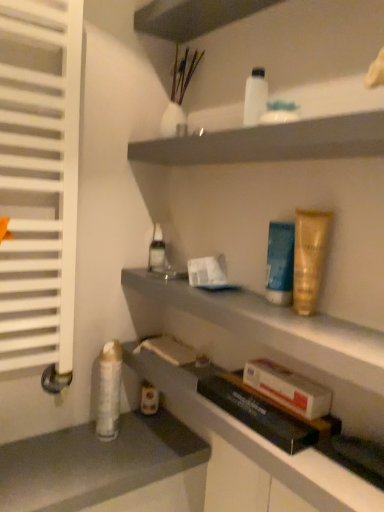
Question: Considering the positions of gold metallic tube at upper right, acting as the 5th toiletry starting from the back, and gray matte counter at lower left in the image, is gold metallic tube at upper right, acting as the 5th toiletry starting from the back, bigger or smaller than gray matte counter at lower left?

Choices:
 (A) small
 (B) big

Answer: (A)

Question: Relative to gray matte counter at lower left, is gold metallic tube at upper right, the 5th toiletry viewed from the left, in front or behind?

Choices:
 (A) behind
 (B) front

Answer: (B)

Question: Estimate the real-world distances between objects in this image. Which object is closer to the white glossy lotion at upper center, which is the fifth toiletry in bottom-to-top order?

Choices:
 (A) gold metallic tube at upper right, arranged as the 3th toiletry when viewed from the top
 (B) translucent glass bottle at center, which appears as the first toiletry when viewed from the back
 (C) white glossy spray can at lower left, the second toiletry positioned from the back
 (D) white glossy shelf at upper center, which appears as the 1th shelf when viewed from the top
 (E) gray matte counter at lower left

Answer: (D)

Question: Based on their relative distances, which object is farther from the blue matte tube at center-right, the fourth toiletry when ordered from left to right?

Choices:
 (A) white glossy shelf at upper center, which appears as the 1th shelf when viewed from the top
 (B) white glossy spray can at lower left, the second toiletry positioned from the back
 (C) gray matte counter at lower left
 (D) gold metallic tube at upper right, arranged as the 3th toiletry when viewed from the top
 (E) matte gray shelf at lower center, which appears as the second shelf when viewed from the top

Answer: (C)